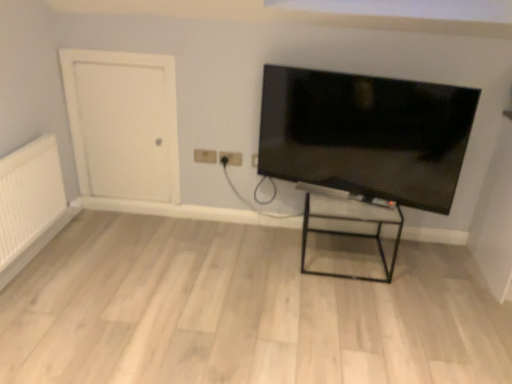
Find the location of a particular element. The width and height of the screenshot is (512, 384). black glossy tv at upper right is located at coordinates (366, 134).

The height and width of the screenshot is (384, 512). What do you see at coordinates (231, 158) in the screenshot? I see `matte plastic outlet at upper center, the 2th electric outlet viewed from the left` at bounding box center [231, 158].

You are a GUI agent. You are given a task and a screenshot of the screen. Output one action in this format:
    pyautogui.click(x=<x>, y=<y>)
    Task: Click on the beige plastic electric outlet at center, placed as the first electric outlet when sorted from left to right
    
    Given the screenshot: What is the action you would take?
    pyautogui.click(x=205, y=156)

Locate an element on the screen. The width and height of the screenshot is (512, 384). transparent glass table at center is located at coordinates [x=352, y=232].

At what (x,y) coordinates should I click in order to perform the action: click on black glossy tv at upper right. Please return your answer as a coordinate pair (x, y). This screenshot has width=512, height=384. Looking at the image, I should click on (366, 134).

Would you say black glossy tv at upper right is outside matte plastic outlet at upper center, the 1th electric outlet when ordered from right to left?

black glossy tv at upper right lies outside matte plastic outlet at upper center, the 1th electric outlet when ordered from right to left,'s area.

Is point (387, 109) farther from camera compared to point (230, 158)?

That is False.

Who is taller, black glossy tv at upper right or matte plastic outlet at upper center, the 1th electric outlet when ordered from right to left?

With more height is black glossy tv at upper right.

Looking at this image, are matte plastic outlet at upper center, the 2th electric outlet viewed from the left, and white matte door at left beside each other?

There is a gap between matte plastic outlet at upper center, the 2th electric outlet viewed from the left, and white matte door at left.

How much distance is there between matte plastic outlet at upper center, the 1th electric outlet when ordered from right to left, and white matte door at left?

matte plastic outlet at upper center, the 1th electric outlet when ordered from right to left, is 26.81 inches from white matte door at left.

Is point (221, 151) closer to viewer compared to point (67, 51)?

No.

Can you confirm if matte plastic outlet at upper center, the 2th electric outlet viewed from the left, is wider than white matte door at left?

No.

From the image's perspective, which object appears higher, white textured radiator at left or beige plastic electric outlet at center, which appears as the 2th electric outlet when viewed from the right?

From the image's view, beige plastic electric outlet at center, which appears as the 2th electric outlet when viewed from the right, is above.

The height and width of the screenshot is (384, 512). What are the coordinates of `radiator in front of the beige plastic electric outlet at center, placed as the first electric outlet when sorted from left to right` in the screenshot? It's located at (29, 195).

From a real-world perspective, is white textured radiator at left on top of beige plastic electric outlet at center, placed as the first electric outlet when sorted from left to right?

No, from a real-world perspective, white textured radiator at left is not on top of beige plastic electric outlet at center, placed as the first electric outlet when sorted from left to right.

From the image's perspective, which one is positioned higher, transparent glass table at center or white matte door at left?

white matte door at left.

Considering the sizes of objects transparent glass table at center and white matte door at left in the image provided, who is bigger, transparent glass table at center or white matte door at left?

With larger size is transparent glass table at center.

Based on the photo, is transparent glass table at center oriented towards white matte door at left?

No, transparent glass table at center is not turned towards white matte door at left.

How far apart are transparent glass table at center and white matte door at left?

They are 4.14 feet apart.

Is beige plastic electric outlet at center, placed as the first electric outlet when sorted from left to right, in contact with white matte door at left?

There is a gap between beige plastic electric outlet at center, placed as the first electric outlet when sorted from left to right, and white matte door at left.

Find the location of `electric outlet that is the 1st object directly below the white matte door at left (from a real-world perspective)`. electric outlet that is the 1st object directly below the white matte door at left (from a real-world perspective) is located at coordinates (205, 156).

From the picture: Is beige plastic electric outlet at center, which appears as the 2th electric outlet when viewed from the right, taller than white matte door at left?

No, beige plastic electric outlet at center, which appears as the 2th electric outlet when viewed from the right, is not taller than white matte door at left.

Who is more distant, white matte door at left or matte plastic outlet at upper center, the 1th electric outlet when ordered from right to left?

matte plastic outlet at upper center, the 1th electric outlet when ordered from right to left, is more distant.

Is there a large distance between white matte door at left and matte plastic outlet at upper center, the 2th electric outlet viewed from the left?

No, white matte door at left is in close proximity to matte plastic outlet at upper center, the 2th electric outlet viewed from the left.

Does white matte door at left have a smaller size compared to matte plastic outlet at upper center, the 2th electric outlet viewed from the left?

Actually, white matte door at left might be larger than matte plastic outlet at upper center, the 2th electric outlet viewed from the left.

Is white textured radiator at left a part of matte plastic outlet at upper center, the 2th electric outlet viewed from the left?

No, white textured radiator at left is located outside of matte plastic outlet at upper center, the 2th electric outlet viewed from the left.

Are matte plastic outlet at upper center, the 2th electric outlet viewed from the left, and white textured radiator at left far apart?

Yes, matte plastic outlet at upper center, the 2th electric outlet viewed from the left, and white textured radiator at left are quite far apart.

Is matte plastic outlet at upper center, the 1th electric outlet when ordered from right to left, to the left of white textured radiator at left from the viewer's perspective?

Incorrect, matte plastic outlet at upper center, the 1th electric outlet when ordered from right to left, is not on the left side of white textured radiator at left.

Based on the photo, can you tell me how much matte plastic outlet at upper center, the 1th electric outlet when ordered from right to left, and white textured radiator at left differ in facing direction?

There is a 90-degree angle between the facing directions of matte plastic outlet at upper center, the 1th electric outlet when ordered from right to left, and white textured radiator at left.

The height and width of the screenshot is (384, 512). I want to click on television located above the matte plastic outlet at upper center, the 1th electric outlet when ordered from right to left (from the image's perspective), so click(x=366, y=134).

The image size is (512, 384). There is a white matte door at left. In order to click on the 2nd electric outlet below it (from the image's perspective) in this screenshot , I will do `click(231, 158)`.

Looking at the image, which one is located further to transparent glass table at center, white matte door at left or beige plastic electric outlet at center, which appears as the 2th electric outlet when viewed from the right?

white matte door at left is positioned further to the anchor transparent glass table at center.

Estimate the real-world distances between objects in this image. Which object is further from beige plastic electric outlet at center, which appears as the 2th electric outlet when viewed from the right, white textured radiator at left or matte plastic outlet at upper center, the 2th electric outlet viewed from the left?

white textured radiator at left is positioned further to the anchor beige plastic electric outlet at center, which appears as the 2th electric outlet when viewed from the right.

Looking at the image, which one is located further to transparent glass table at center, matte plastic outlet at upper center, the 2th electric outlet viewed from the left, or beige plastic electric outlet at center, which appears as the 2th electric outlet when viewed from the right?

beige plastic electric outlet at center, which appears as the 2th electric outlet when viewed from the right.

Based on their spatial positions, is matte plastic outlet at upper center, the 1th electric outlet when ordered from right to left, or transparent glass table at center further from black glossy tv at upper right?

Among the two, matte plastic outlet at upper center, the 1th electric outlet when ordered from right to left, is located further to black glossy tv at upper right.

Looking at the image, which one is located further to beige plastic electric outlet at center, which appears as the 2th electric outlet when viewed from the right, white matte door at left or transparent glass table at center?

transparent glass table at center is further to beige plastic electric outlet at center, which appears as the 2th electric outlet when viewed from the right.

Considering their positions, is white textured radiator at left positioned closer to white matte door at left than matte plastic outlet at upper center, the 1th electric outlet when ordered from right to left?

white textured radiator at left is closer to white matte door at left.

From the image, which object appears to be nearer to matte plastic outlet at upper center, the 2th electric outlet viewed from the left, beige plastic electric outlet at center, placed as the first electric outlet when sorted from left to right, or transparent glass table at center?

beige plastic electric outlet at center, placed as the first electric outlet when sorted from left to right.

Estimate the real-world distances between objects in this image. Which object is closer to beige plastic electric outlet at center, which appears as the 2th electric outlet when viewed from the right, black glossy tv at upper right or matte plastic outlet at upper center, the 1th electric outlet when ordered from right to left?

matte plastic outlet at upper center, the 1th electric outlet when ordered from right to left, is closer to beige plastic electric outlet at center, which appears as the 2th electric outlet when viewed from the right.

Where is `electric outlet located between beige plastic electric outlet at center, which appears as the 2th electric outlet when viewed from the right, and black glossy tv at upper right in the left-right direction`? electric outlet located between beige plastic electric outlet at center, which appears as the 2th electric outlet when viewed from the right, and black glossy tv at upper right in the left-right direction is located at coordinates (231, 158).

Where is `door between white textured radiator at left and transparent glass table at center`? The image size is (512, 384). door between white textured radiator at left and transparent glass table at center is located at coordinates (123, 123).

Locate an element on the screen. television between white matte door at left and transparent glass table at center is located at coordinates (366, 134).

Where is `door between white textured radiator at left and matte plastic outlet at upper center, the 2th electric outlet viewed from the left, from left to right`? The image size is (512, 384). door between white textured radiator at left and matte plastic outlet at upper center, the 2th electric outlet viewed from the left, from left to right is located at coordinates (123, 123).